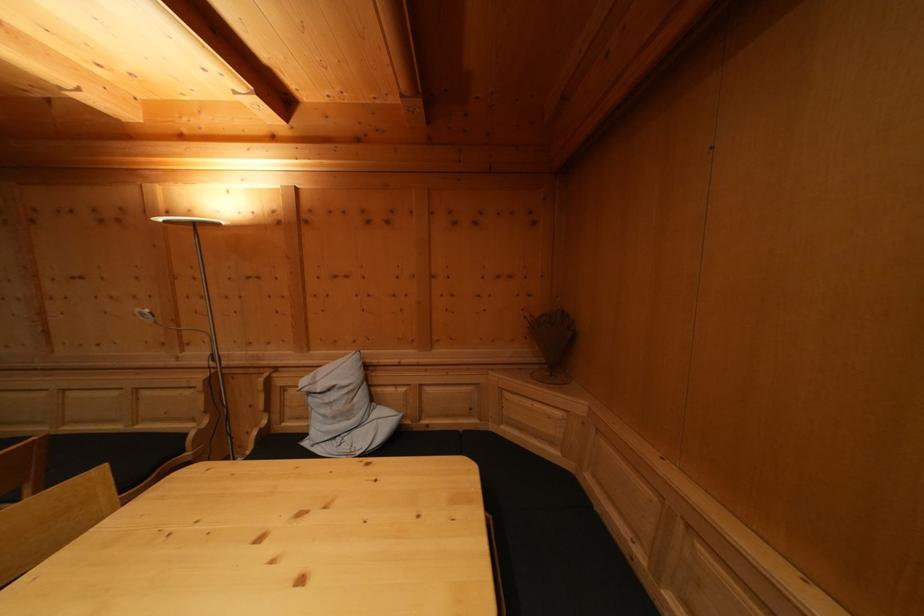
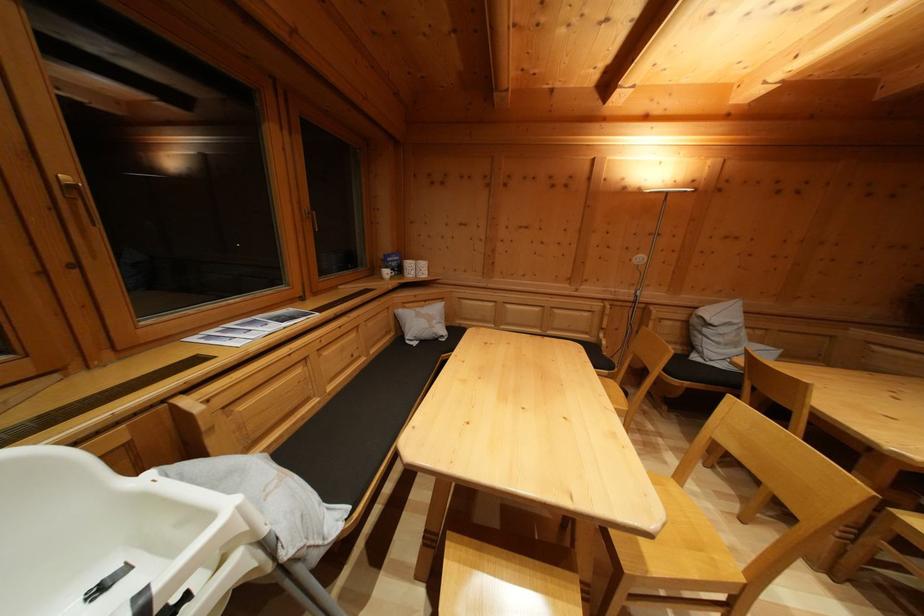
The point at (317, 407) is marked in the first image. Where is the corresponding point in the second image?

(711, 337)